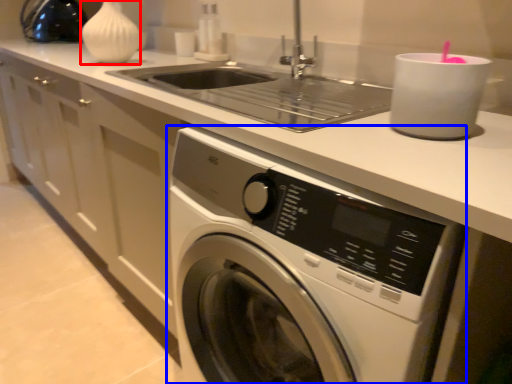
Question: Which point is closer to the camera, vase (highlighted by a red box) or washing machine (highlighted by a blue box)?

Choices:
 (A) vase
 (B) washing machine

Answer: (B)